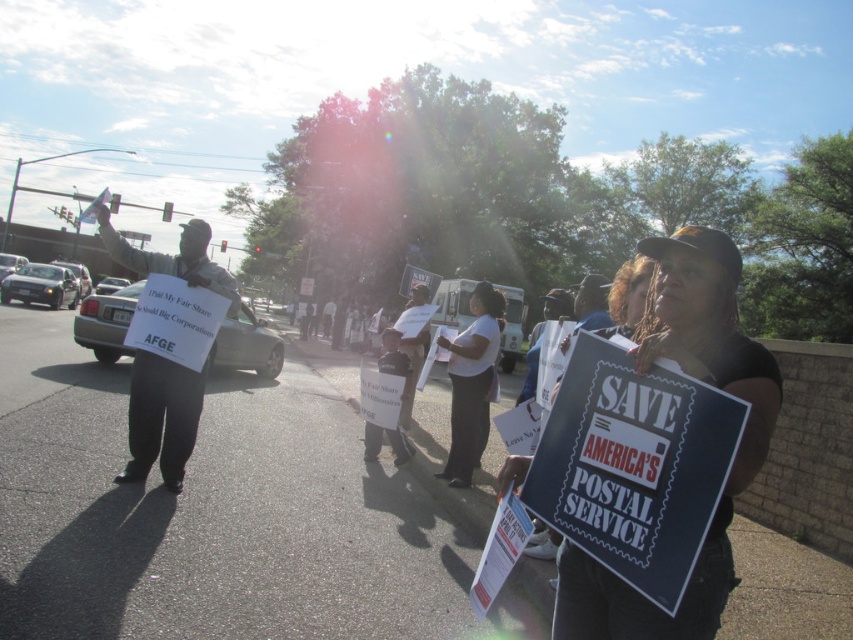
You are a photographer standing at the edge of the protest crowd. You want to take a photo of the black fabric sign at center and the white cotton shirt at center. If your camera has a depth of field that can focus on objects within 10 feet of each other, will both objects be in focus?

The black fabric sign at center is 13.55 feet from the white cotton shirt at center, which is beyond the 10 feet depth of field range. Therefore, both objects cannot be in focus simultaneously.

You are a journalist taking photos of the protest. You notice the black fabric sign at center and the white cotton shirt at center. Which object is closer to the camera?

The black fabric sign at center is closer to the camera because it is in front of the white cotton shirt at center.